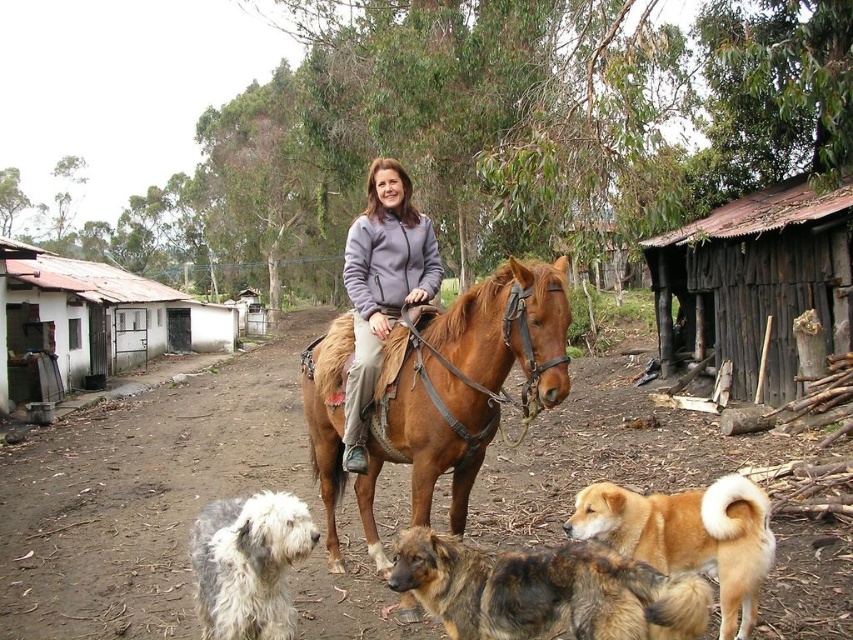
Question: Can you confirm if brown leather horse at center is smaller than gray shaggy dog at lower left?

Choices:
 (A) no
 (B) yes

Answer: (B)

Question: In this image, where is brown dirt track at center located relative to golden fur dog at lower right?

Choices:
 (A) below
 (B) above

Answer: (A)

Question: Which of the following is the farthest from the observer?

Choices:
 (A) white wood hut at left
 (B) gray shaggy dog at lower left
 (C) brown leather horse at center
 (D) weathered wood hut at center-right

Answer: (A)

Question: Can you confirm if brown leather horse at center is thinner than gray shaggy dog at lower left?

Choices:
 (A) no
 (B) yes

Answer: (B)

Question: Which point appears farthest from the camera in this image?

Choices:
 (A) (393, 524)
 (B) (405, 280)

Answer: (A)

Question: Which point appears closest to the camera in this image?

Choices:
 (A) (201, 516)
 (B) (532, 353)
 (C) (51, 314)

Answer: (B)